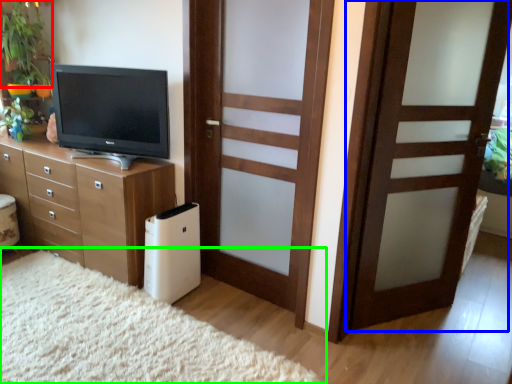
Question: Considering the real-world distances, which object is closest to plant (highlighted by a red box)? door (highlighted by a blue box) or plain (highlighted by a green box).

Choices:
 (A) door
 (B) plain

Answer: (B)